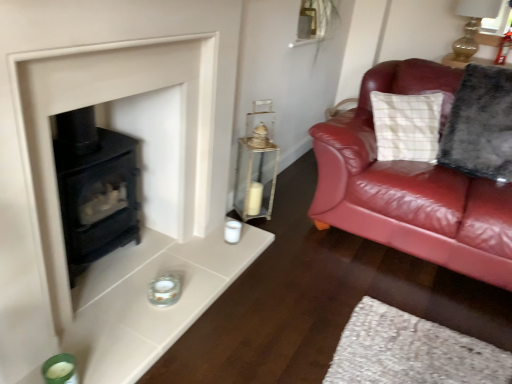
Question: Is fluffy gray pillow at right shorter than green glass candle holder at lower left, the first candle holder from the bottom?

Choices:
 (A) yes
 (B) no

Answer: (B)

Question: Can you see fluffy gray pillow at right touching green glass candle holder at lower left, the first candle holder from the bottom?

Choices:
 (A) yes
 (B) no

Answer: (B)

Question: From a real-world perspective, is fluffy gray pillow at right on green glass candle holder at lower left, which ranks as the 1th candle holder in front-to-back order?

Choices:
 (A) no
 (B) yes

Answer: (B)

Question: Is fluffy gray pillow at right to the left of green glass candle holder at lower left, which ranks as the 1th candle holder in front-to-back order, from the viewer's perspective?

Choices:
 (A) yes
 (B) no

Answer: (B)

Question: From the image's perspective, is fluffy gray pillow at right beneath green glass candle holder at lower left, which ranks as the 1th candle holder in front-to-back order?

Choices:
 (A) no
 (B) yes

Answer: (A)

Question: In terms of width, does fluffy gray pillow at right look wider or thinner when compared to clear glass lantern at center?

Choices:
 (A) thin
 (B) wide

Answer: (B)

Question: In terms of size, does fluffy gray pillow at right appear bigger or smaller than clear glass lantern at center?

Choices:
 (A) big
 (B) small

Answer: (A)

Question: From a real-world perspective, is fluffy gray pillow at right positioned above or below clear glass lantern at center?

Choices:
 (A) below
 (B) above

Answer: (B)

Question: From the image's perspective, is fluffy gray pillow at right above or below clear glass lantern at center?

Choices:
 (A) below
 (B) above

Answer: (B)

Question: Is matte black stove at lower left inside or outside of green glass candle holder at lower left, marked as the first candle holder in a left-to-right arrangement?

Choices:
 (A) outside
 (B) inside

Answer: (A)

Question: Looking at their shapes, would you say matte black stove at lower left is wider or thinner than green glass candle holder at lower left, the 2th candle holder positioned from the top?

Choices:
 (A) wide
 (B) thin

Answer: (B)

Question: From the image's perspective, is matte black stove at lower left located above or below green glass candle holder at lower left, which ranks as the 1th candle holder in front-to-back order?

Choices:
 (A) below
 (B) above

Answer: (B)

Question: From a real-world perspective, relative to green glass candle holder at lower left, which appears as the 2th candle holder when viewed from the right, is matte black stove at lower left vertically above or below?

Choices:
 (A) above
 (B) below

Answer: (A)

Question: Would you say green glass candle holder at lower left, which appears as the 2th candle holder when viewed from the right, is to the left or to the right of matte glass candle holder at lower center, arranged as the 1th candle holder when viewed from the back, in the picture?

Choices:
 (A) right
 (B) left

Answer: (B)

Question: In terms of height, does green glass candle holder at lower left, which appears as the 2th candle holder when viewed from the right, look taller or shorter compared to matte glass candle holder at lower center, which appears as the 2th candle holder when viewed from the front?

Choices:
 (A) short
 (B) tall

Answer: (B)